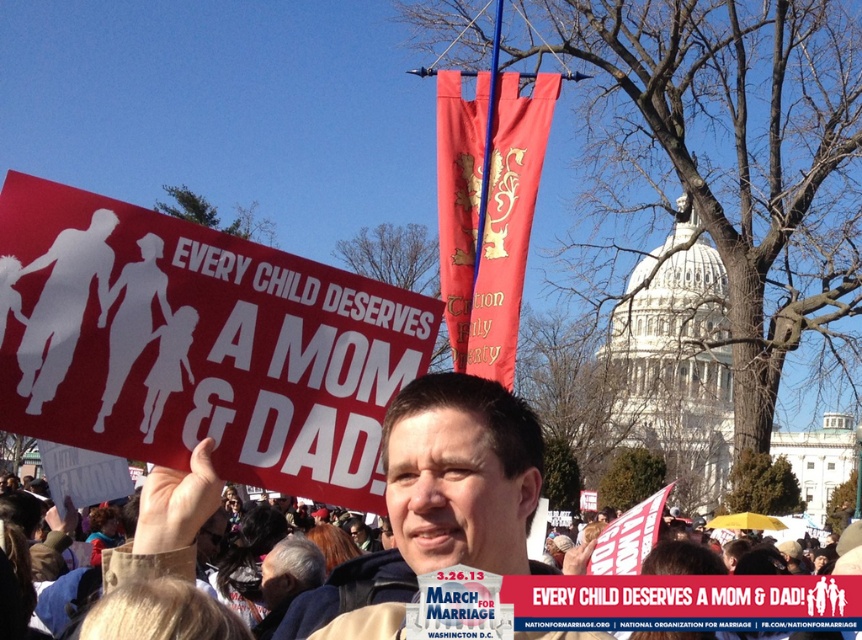
Question: Which point appears farthest from the camera in this image?

Choices:
 (A) (501, 531)
 (B) (114, 330)

Answer: (B)

Question: Can you confirm if matte red sign at left is positioned to the left of matte black sign at center?

Choices:
 (A) yes
 (B) no

Answer: (A)

Question: In this image, where is matte red sign at left located relative to matte black sign at center?

Choices:
 (A) right
 (B) left

Answer: (B)

Question: Can you confirm if matte red sign at left is positioned above matte black sign at center?

Choices:
 (A) no
 (B) yes

Answer: (B)